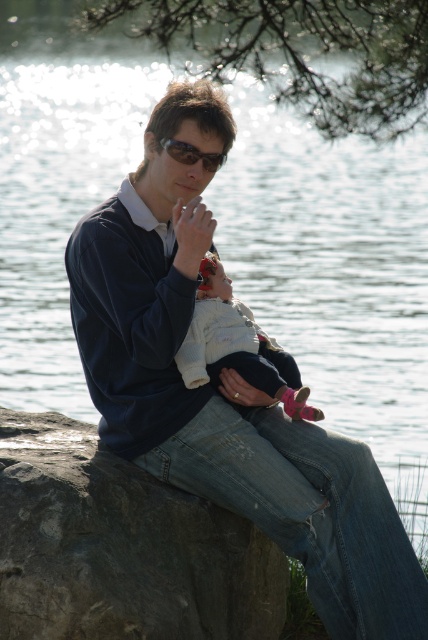
You are standing at the point with coordinates point (234, 326) and want to move to the point with coordinates point (196, 438). Is the destination point in front of you or behind you?

The destination point point (196, 438) is in front of point (234, 326), so the destination point is in front of you.